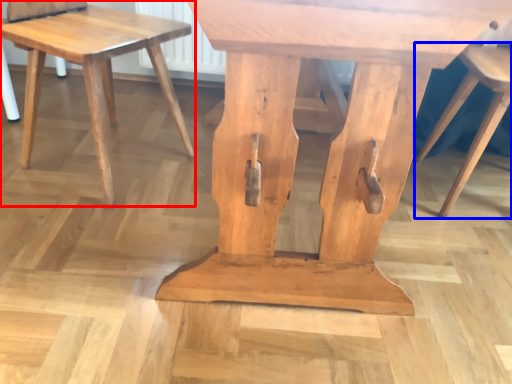
Question: Which point is further to the camera, stool (highlighted by a red box) or stool (highlighted by a blue box)?

Choices:
 (A) stool
 (B) stool

Answer: (B)